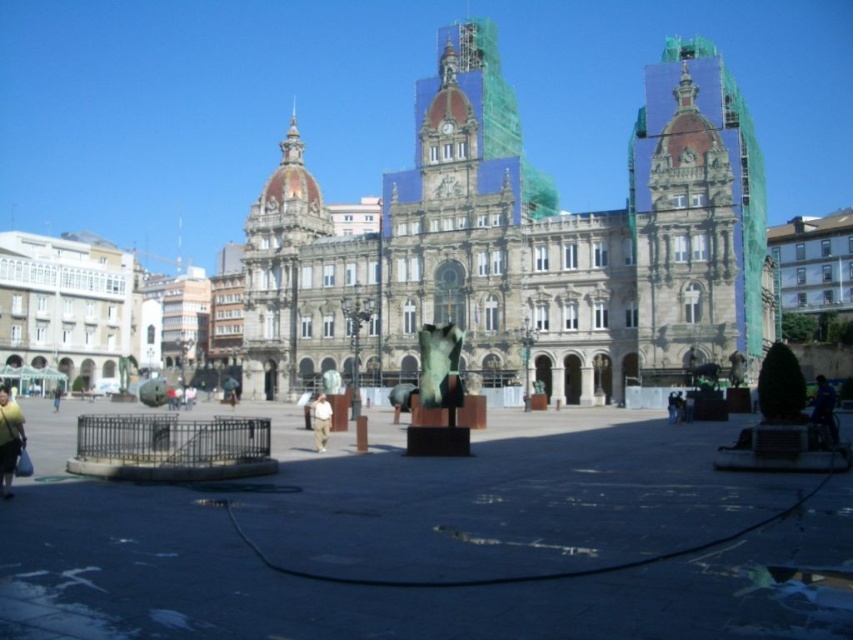
Between stone building at center and yellow fabric bag at lower left, which one is positioned lower?

yellow fabric bag at lower left

Is stone building at center bigger than yellow fabric bag at lower left?

Correct, stone building at center is larger in size than yellow fabric bag at lower left.

From the picture: Who is more forward, (639,276) or (16,444)?

Point (16,444)

Where is `stone building at center`? stone building at center is located at coordinates [x=521, y=244].

Can you confirm if yellow fabric bag at lower left is taller than light brown leather jacket at lower left?

Yes, yellow fabric bag at lower left is taller than light brown leather jacket at lower left.

What do you see at coordinates (9, 440) in the screenshot? The image size is (853, 640). I see `yellow fabric bag at lower left` at bounding box center [9, 440].

Where is `yellow fabric bag at lower left`? This screenshot has height=640, width=853. yellow fabric bag at lower left is located at coordinates pos(9,440).

Between brushed metal cage at center and dark blue fabric at lower right, which one has less height?

With less height is dark blue fabric at lower right.

Can you confirm if brushed metal cage at center is taller than dark blue fabric at lower right?

Correct, brushed metal cage at center is much taller as dark blue fabric at lower right.

Is point (178, 422) more distant than point (811, 397)?

No, it is not.

The width and height of the screenshot is (853, 640). I want to click on brushed metal cage at center, so click(171, 448).